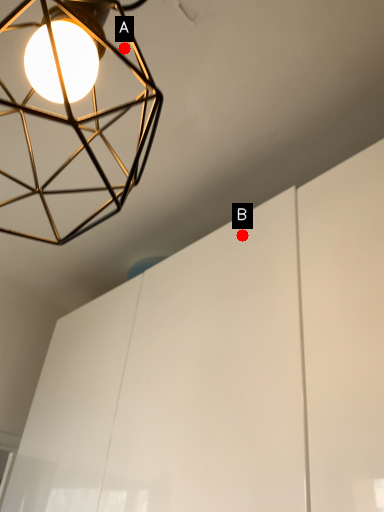
Question: Two points are circled on the image, labeled by A and B beside each circle. Which point is closer to the camera?

Choices:
 (A) A is closer
 (B) B is closer

Answer: (A)